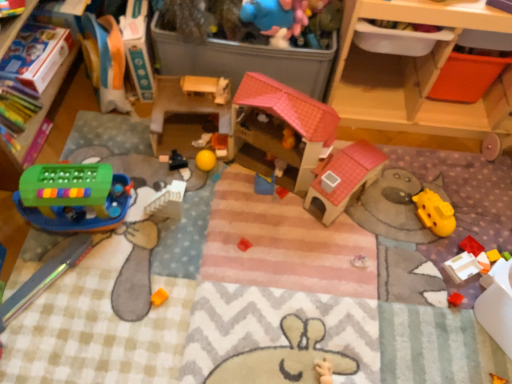
Image resolution: width=512 pixels, height=384 pixels. I want to click on vacant space that's between yellow rubber ball at center, which is counted as the fifth toy, starting from the left, and white plastic block at lower right, acting as the eighth toy starting from the left, so click(342, 225).